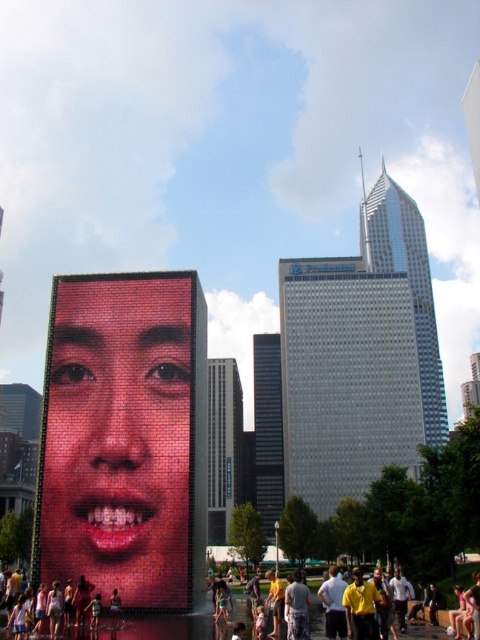
Question: Which of these objects is positioned closest to the matte digital display at center?

Choices:
 (A) matte black face at center
 (B) matte pink lips at center

Answer: (B)

Question: Which of the following is the farthest from the observer?

Choices:
 (A) matte black face at center
 (B) matte pink lips at center
 (C) matte digital display at center

Answer: (B)

Question: Can you confirm if matte pink lips at center is bigger than matte black face at center?

Choices:
 (A) yes
 (B) no

Answer: (B)

Question: Does matte pink lips at center come behind matte black face at center?

Choices:
 (A) yes
 (B) no

Answer: (A)

Question: Can you confirm if matte pink face at center is bigger than matte black face at center?

Choices:
 (A) no
 (B) yes

Answer: (A)

Question: Which point appears closest to the camera in this image?

Choices:
 (A) (190, 355)
 (B) (97, 636)

Answer: (B)